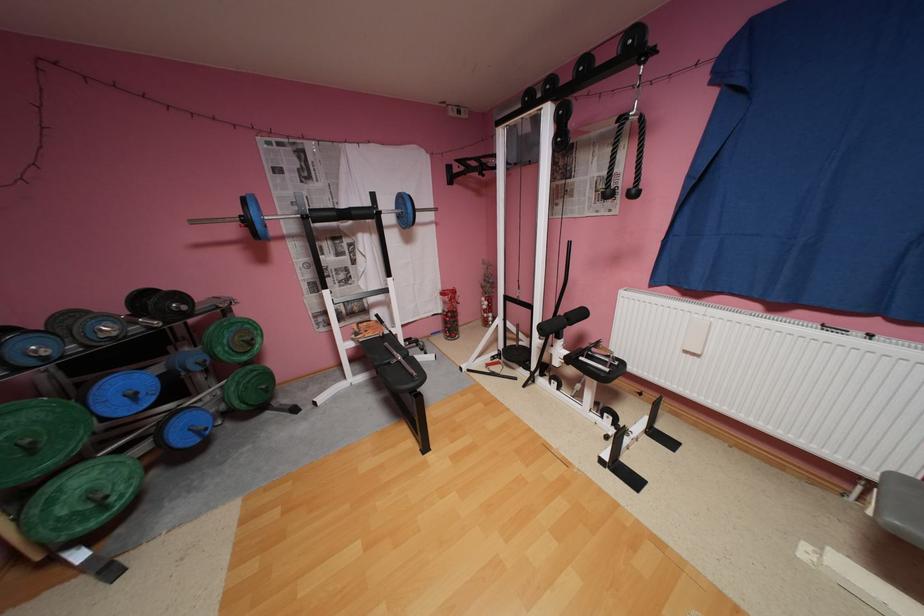
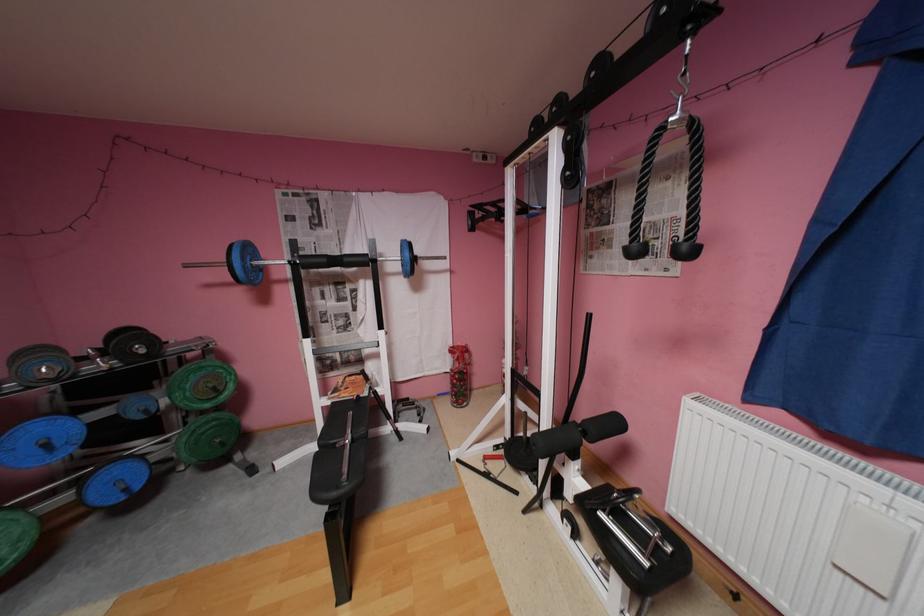
Find the pixel in the second image that matches pixel 642 191 in the first image.

(695, 246)